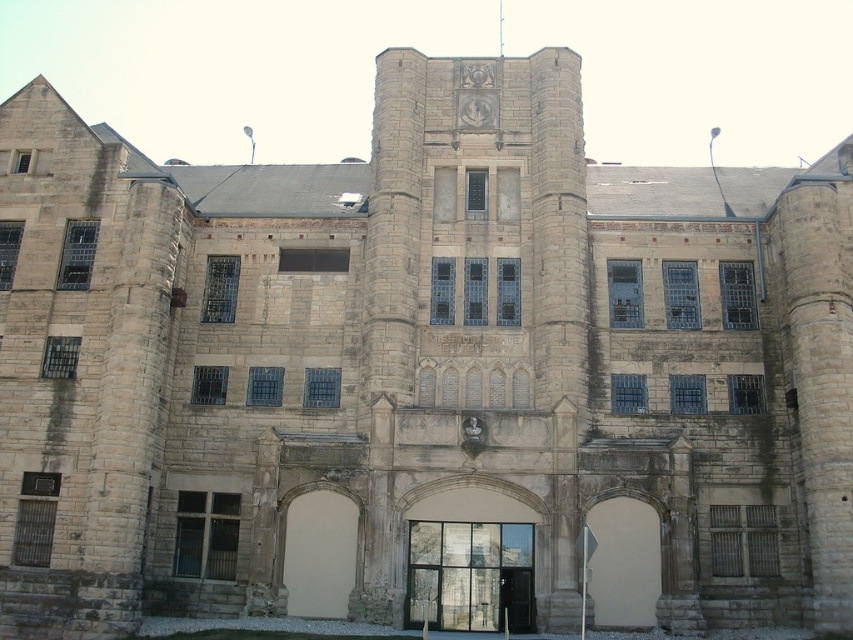
You are a delivery person trying to enter the Missouri State Penitentiary. You see the smooth beige door at center and the white stone archway at center. Which one is wider?

The smooth beige door at center is wider than the white stone archway at center.

From the picture: You are a delivery person with a cart that is 20 feet long. You need to move your cart through the entrance of the building. Can you fit your cart through the space between the clear glass door at center and the white stone archway at center?

The distance between the clear glass door at center and the white stone archway at center is 19.45 feet. Since your cart is 20 feet long, it is slightly longer than the available space, so it won measurements. You cannot fit your cart through that entrance.

Consider the image. You are a delivery person trying to enter the Missouri State Penitentiary. You see the clear glass door at center and the white stone archway at center. Which one is wider? Please answer based on the provided information.

The clear glass door at center is wider than the white stone archway at center.